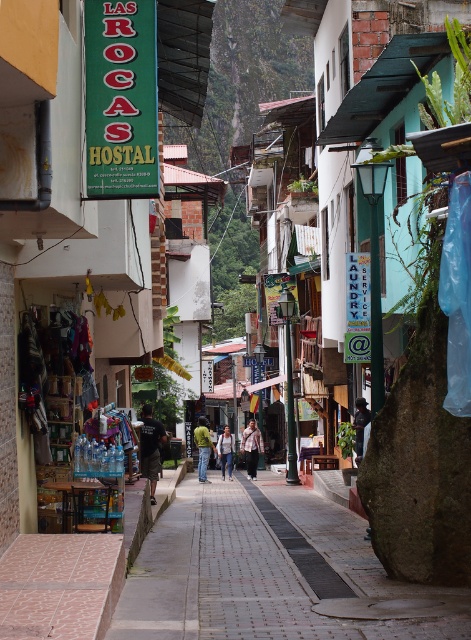
Is paved stone sidewalk at center taller than dark gray t-shirt at center?

Correct, paved stone sidewalk at center is much taller as dark gray t-shirt at center.

Which is more to the right, paved stone sidewalk at center or dark gray t-shirt at center?

Positioned to the right is paved stone sidewalk at center.

Image resolution: width=471 pixels, height=640 pixels. What are the coordinates of `paved stone sidewalk at center` in the screenshot? It's located at (268, 572).

Is green fabric jacket at center taller than light blue denim jeans at center?

No, green fabric jacket at center is not taller than light blue denim jeans at center.

Does green fabric jacket at center have a lesser height compared to light blue denim jeans at center?

Yes, green fabric jacket at center is shorter than light blue denim jeans at center.

Which is behind, point (194, 435) or point (228, 458)?

Point (194, 435)

Locate an element on the screen. green fabric jacket at center is located at coordinates (203, 448).

Is dark gray t-shirt at center above plaid shirt at center?

Correct, dark gray t-shirt at center is located above plaid shirt at center.

Is dark gray t-shirt at center positioned in front of plaid shirt at center?

Yes, it is.

Which is in front, point (157, 428) or point (245, 445)?

Point (157, 428)

I want to click on dark gray t-shirt at center, so click(151, 448).